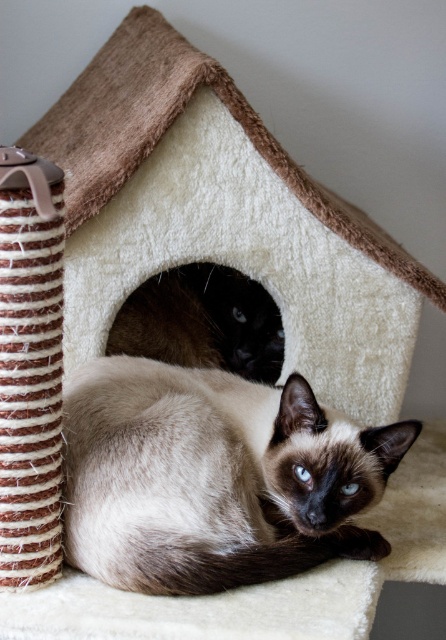
Question: Which of the following is the closest to the observer?

Choices:
 (A) smokey brown fur cat at center
 (B) smokey brown fur at center

Answer: (A)

Question: Is smokey brown fur cat at center positioned at the back of smokey brown fur at center?

Choices:
 (A) no
 (B) yes

Answer: (A)

Question: Can you confirm if smokey brown fur cat at center is smaller than smokey brown fur at center?

Choices:
 (A) no
 (B) yes

Answer: (A)

Question: Does smokey brown fur cat at center appear under smokey brown fur at center?

Choices:
 (A) yes
 (B) no

Answer: (A)